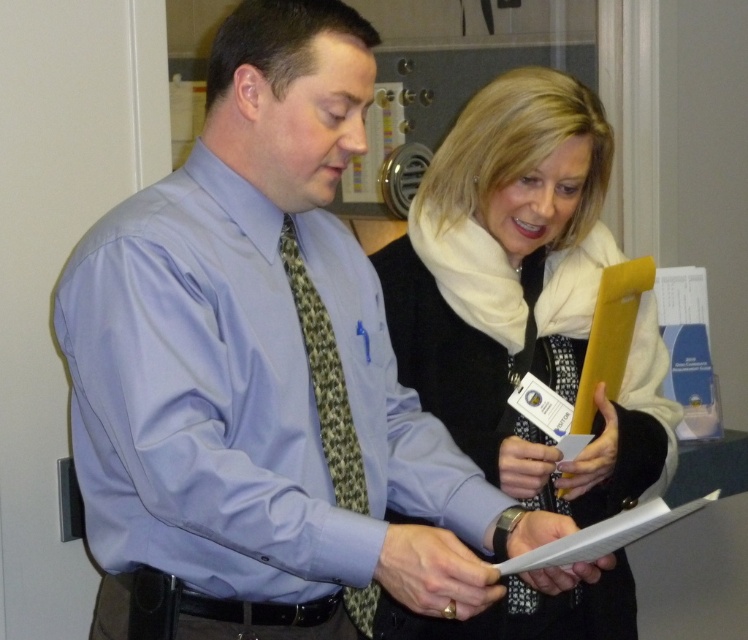
Question: Does white scarf at upper right appear under green patterned tie at center?

Choices:
 (A) no
 (B) yes

Answer: (A)

Question: Among these objects, which one is farthest from the camera?

Choices:
 (A) white scarf at upper right
 (B) green patterned tie at center

Answer: (A)

Question: Which point is closer to the camera?

Choices:
 (A) green patterned tie at center
 (B) white scarf at upper right

Answer: (A)

Question: Is white scarf at upper right further to the viewer compared to green patterned tie at center?

Choices:
 (A) no
 (B) yes

Answer: (B)

Question: Does white scarf at upper right have a lesser width compared to green patterned tie at center?

Choices:
 (A) yes
 (B) no

Answer: (B)

Question: Which point is farther to the camera?

Choices:
 (A) white scarf at upper right
 (B) green patterned tie at center

Answer: (A)